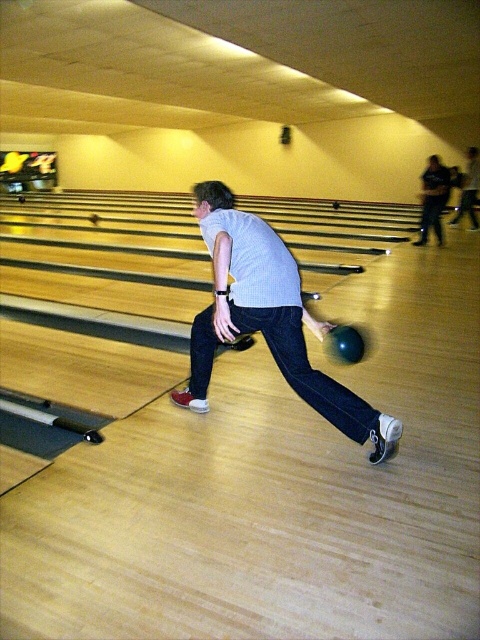
Does dark gray shirt at center have a larger size compared to shiny blue bowling ball at center?

Yes.

Is point (468, 202) closer to camera compared to point (355, 340)?

No, it is behind (355, 340).

Does point (452, 220) lie behind point (351, 353)?

That is True.

Find the location of a particular element. dark gray shirt at center is located at coordinates (468, 189).

Does point (392, 422) lie behind point (444, 192)?

No.

Between matte gray shirt at center and dark blue jeans at upper right, which one appears on the left side from the viewer's perspective?

matte gray shirt at center

Is point (226, 273) farther from camera compared to point (431, 170)?

No.

I want to click on matte gray shirt at center, so click(x=267, y=320).

Can you confirm if dark blue jeans at upper right is positioned to the right of shiny blue bowling ball at center?

Yes, dark blue jeans at upper right is to the right of shiny blue bowling ball at center.

In the scene shown: Can you confirm if dark blue jeans at upper right is positioned to the left of shiny blue bowling ball at center?

Incorrect, dark blue jeans at upper right is not on the left side of shiny blue bowling ball at center.

Between point (439, 220) and point (348, 339), which one is positioned in front?

Point (348, 339) is in front.

The image size is (480, 640). Find the location of `dark blue jeans at upper right`. dark blue jeans at upper right is located at coordinates (432, 198).